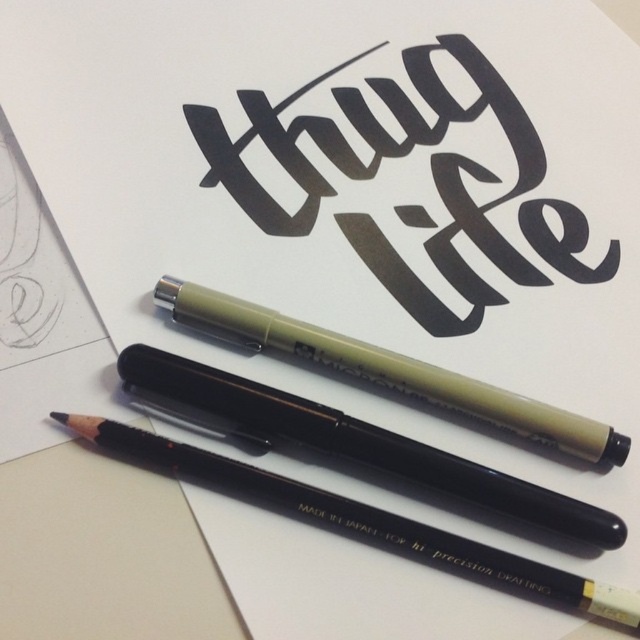
You are a photographer adjusting your camera focus. You see two points in the image, one at point (333, 166) and the other at point (592, 429). Which point should you focus on first to ensure the closest object is sharp?

Point (333, 166) is further to the camera than point (592, 429), so you should focus on point (333, 166) first to ensure the closest object is sharp.

From the picture: You are an artist preparing to sign a contract. You have two pens available on your desk, the black calligraphy at center and the matte olive pen at center. Which pen should you choose if you want the signature to be more visible from a distance?

The black calligraphy at center is taller than the matte olive pen at center, so it would create a more visible signature from a distance due to its larger size.